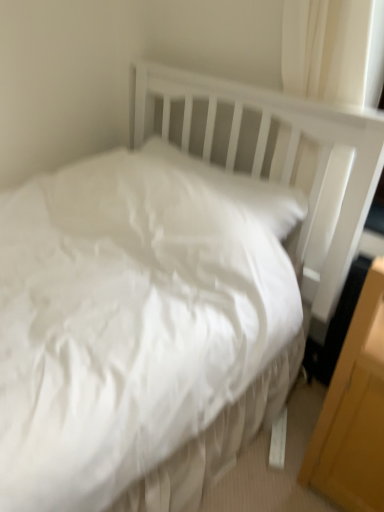
At what (x,y) coordinates should I click in order to perform the action: click on yellow wood/file cabinet at lower right. Please return your answer as a coordinate pair (x, y). Looking at the image, I should click on (354, 411).

You are a GUI agent. You are given a task and a screenshot of the screen. Output one action in this format:
    pyautogui.click(x=<x>, y=<y>)
    Task: Click on the yellow wood/file cabinet at lower right
    The image size is (384, 512).
    Given the screenshot: What is the action you would take?
    pyautogui.click(x=354, y=411)

Is point (293, 90) farther from camera compared to point (272, 194)?

No.

From the image's perspective, which one is positioned higher, white fabric curtain at upper right or white soft pillow at upper center?

white fabric curtain at upper right.

At what (x,y) coordinates should I click in order to perform the action: click on curtain that is in front of the white soft pillow at upper center. Please return your answer as a coordinate pair (x, y). The image size is (384, 512). Looking at the image, I should click on (326, 49).

Is the position of white fabric curtain at upper right less distant than that of white soft pillow at upper center?

That is True.

Which object is thinner, white fabric curtain at upper right or yellow wood/file cabinet at lower right?

Thinner between the two is white fabric curtain at upper right.

Between white fabric curtain at upper right and yellow wood/file cabinet at lower right, which one has more height?

Standing taller between the two is yellow wood/file cabinet at lower right.

Looking at this image, from a real-world perspective, is white fabric curtain at upper right over yellow wood/file cabinet at lower right?

Yes, from a real-world perspective, white fabric curtain at upper right is over yellow wood/file cabinet at lower right

Is white fabric curtain at upper right inside the boundaries of yellow wood/file cabinet at lower right, or outside?

white fabric curtain at upper right is located beyond the bounds of yellow wood/file cabinet at lower right.

Considering the sizes of objects yellow wood/file cabinet at lower right and white soft pillow at upper center in the image provided, who is shorter, yellow wood/file cabinet at lower right or white soft pillow at upper center?

With less height is white soft pillow at upper center.

Choose the correct answer: Is yellow wood/file cabinet at lower right inside white soft pillow at upper center or outside it?

yellow wood/file cabinet at lower right is outside white soft pillow at upper center.

You are a GUI agent. You are given a task and a screenshot of the screen. Output one action in this format:
    pyautogui.click(x=<x>, y=<y>)
    Task: Click on the file cabinet in front of the white soft pillow at upper center
    
    Given the screenshot: What is the action you would take?
    pyautogui.click(x=354, y=411)

From the image's perspective, would you say yellow wood/file cabinet at lower right is positioned over white soft pillow at upper center?

Incorrect, from the image's perspective, yellow wood/file cabinet at lower right is lower than white soft pillow at upper center.

From the image's perspective, is white soft pillow at upper center located above or below white fabric curtain at upper right?

Clearly, from the image's perspective, white soft pillow at upper center is below white fabric curtain at upper right.

From a real-world perspective, between white soft pillow at upper center and white fabric curtain at upper right, who is vertically higher?

white fabric curtain at upper right.

Identify the location of curtain in front of the white soft pillow at upper center. Image resolution: width=384 pixels, height=512 pixels. (326, 49).

Are white soft pillow at upper center and white fabric curtain at upper right far apart?

No.

Is yellow wood/file cabinet at lower right located within white soft pillow at upper center?

No, yellow wood/file cabinet at lower right is not inside white soft pillow at upper center.

Between white soft pillow at upper center and yellow wood/file cabinet at lower right, which one appears on the right side from the viewer's perspective?

From the viewer's perspective, yellow wood/file cabinet at lower right appears more on the right side.

The height and width of the screenshot is (512, 384). Find the location of `file cabinet in front of the white soft pillow at upper center`. file cabinet in front of the white soft pillow at upper center is located at coordinates (354, 411).

In the image, is yellow wood/file cabinet at lower right on the left side or the right side of white fabric curtain at upper right?

From the image, it's evident that yellow wood/file cabinet at lower right is to the right of white fabric curtain at upper right.

Is white fabric curtain at upper right completely or partially inside yellow wood/file cabinet at lower right?

No.

Where is `curtain above the yellow wood/file cabinet at lower right (from the image's perspective)`? curtain above the yellow wood/file cabinet at lower right (from the image's perspective) is located at coordinates (326, 49).

Where is `pillow that appears behind the white fabric curtain at upper right`? pillow that appears behind the white fabric curtain at upper right is located at coordinates (240, 187).

Locate an element on the screen. Image resolution: width=384 pixels, height=512 pixels. file cabinet below the white fabric curtain at upper right (from a real-world perspective) is located at coordinates (354, 411).

Based on their spatial positions, is white soft pillow at upper center or yellow wood/file cabinet at lower right further from white fabric curtain at upper right?

yellow wood/file cabinet at lower right lies further to white fabric curtain at upper right than the other object.

Looking at the image, which one is located closer to yellow wood/file cabinet at lower right, white soft pillow at upper center or white fabric curtain at upper right?

Among the two, white fabric curtain at upper right is located nearer to yellow wood/file cabinet at lower right.

In the scene shown: Estimate the real-world distances between objects in this image. Which object is closer to white soft pillow at upper center, yellow wood/file cabinet at lower right or white fabric curtain at upper right?

The object closer to white soft pillow at upper center is white fabric curtain at upper right.

Estimate the real-world distances between objects in this image. Which object is further from white fabric curtain at upper right, yellow wood/file cabinet at lower right or white soft pillow at upper center?

Based on the image, yellow wood/file cabinet at lower right appears to be further to white fabric curtain at upper right.

From the picture: Considering their positions, is white fabric curtain at upper right positioned closer to yellow wood/file cabinet at lower right than white soft pillow at upper center?

white fabric curtain at upper right.

When comparing their distances from white soft pillow at upper center, does white fabric curtain at upper right or yellow wood/file cabinet at lower right seem closer?

white fabric curtain at upper right.

This screenshot has height=512, width=384. I want to click on pillow between white fabric curtain at upper right and yellow wood/file cabinet at lower right in the up-down direction, so click(240, 187).